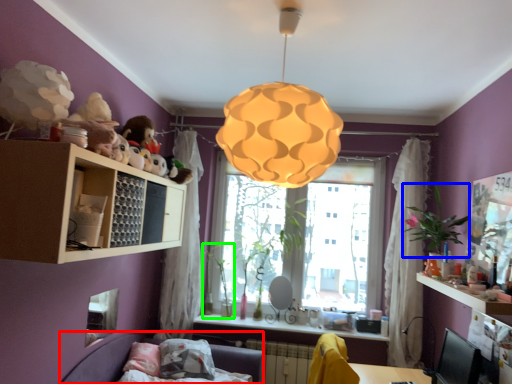
Question: Which object is the farthest from couch (highlighted by a red box)? Choose among these: plant (highlighted by a blue box) or plant (highlighted by a green box).

Choices:
 (A) plant
 (B) plant

Answer: (A)